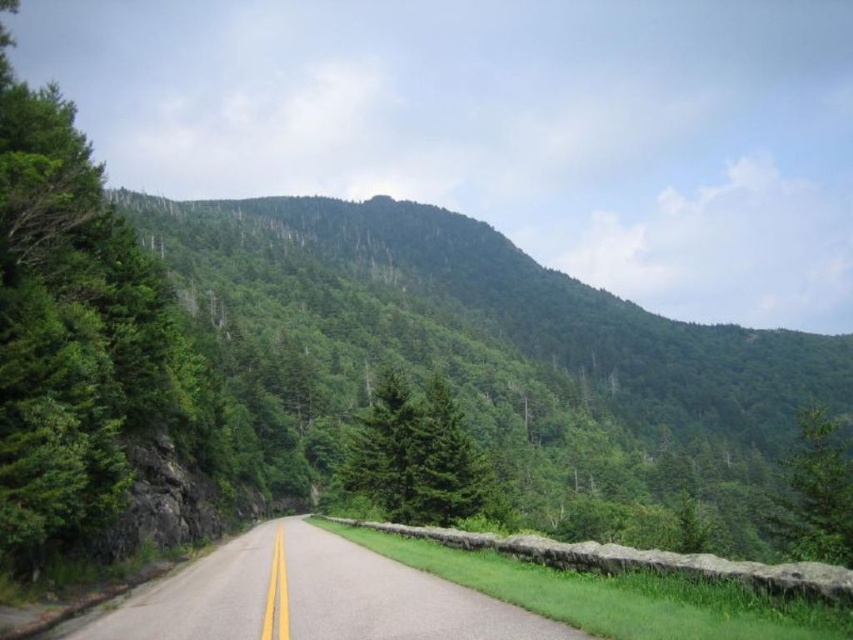
Based on the photo, you are driving a car that is 5 meters long. You want to park your car exactly where the camera is positioned. Is there enough space to park your car without overlapping the green matte tree at center?

The distance between the green matte tree at center and the camera is 52.47 meters. Since the car is only 5 meters long, there is ample space to park without overlapping the tree.

You are a drone operator planning to fly a drone over the asphalt road at center. The drone has a GPS coordinate system where the bottom left corner of the image is the origin point. The drone must stay within the road area to avoid obstacles. Given that the road is at position point 0.933, 0.368, what is the safest path for the drone to follow?

Result: The safest path for the drone is to follow the asphalt road at center, which is located at position point (312, 596) in the image, ensuring it stays within the road area to avoid obstacles.

You are a hiker planning to walk along the asphalt road at center and the green matte tree at center. Which one takes up more space in the image?

The green matte tree at center occupies more space than the asphalt road at center.